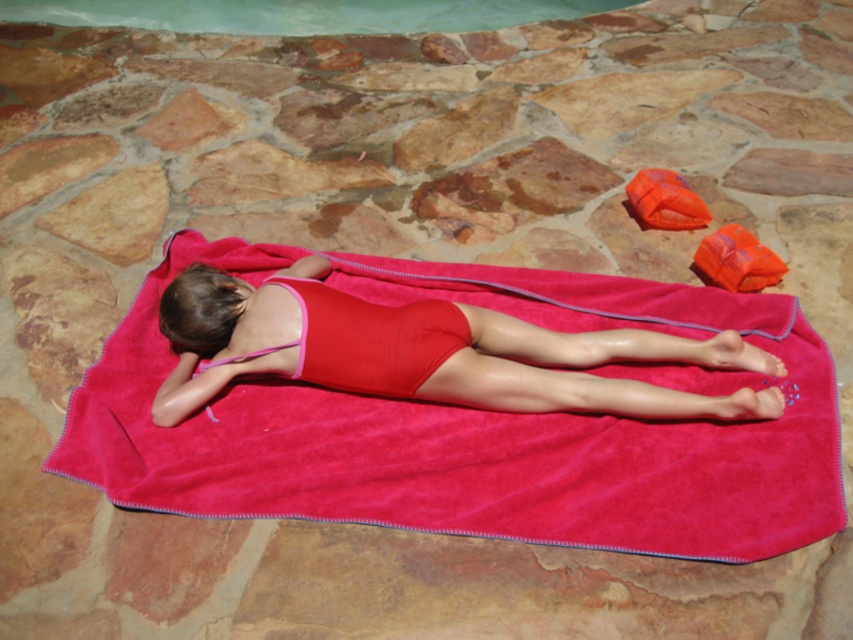
You are a lifeguard who needs to retrieve the matte red swimsuit at center from the pool area. The pool deck has a non slip surface. Can you safely walk over the matte pink towel at center to reach it?

The matte pink towel at center is 6.46 inches away from the matte red swimsuit at center. Since the distance is minimal, you can safely step over the matte pink towel at center to reach the matte red swimsuit at center without slipping, as the non slip surface ensures stability.

You are a lifeguard on duty and need to locate the clear glass pool at upper center and the matte red swimsuit at center. According to the scene, which object is positioned to the left of the other?

The clear glass pool at upper center is to the left of the matte red swimsuit at center because the matte red swimsuit at center is to the right of the clear glass pool at upper center.

You are a lifeguard who needs to reach the clear glass pool at upper center from the matte pink towel at center. Can you walk directly between them without stepping on any objects?

The distance between the matte pink towel at center and the clear glass pool at upper center is 9.01 feet, so yes, you can walk directly between them without stepping on any objects since there is enough space.